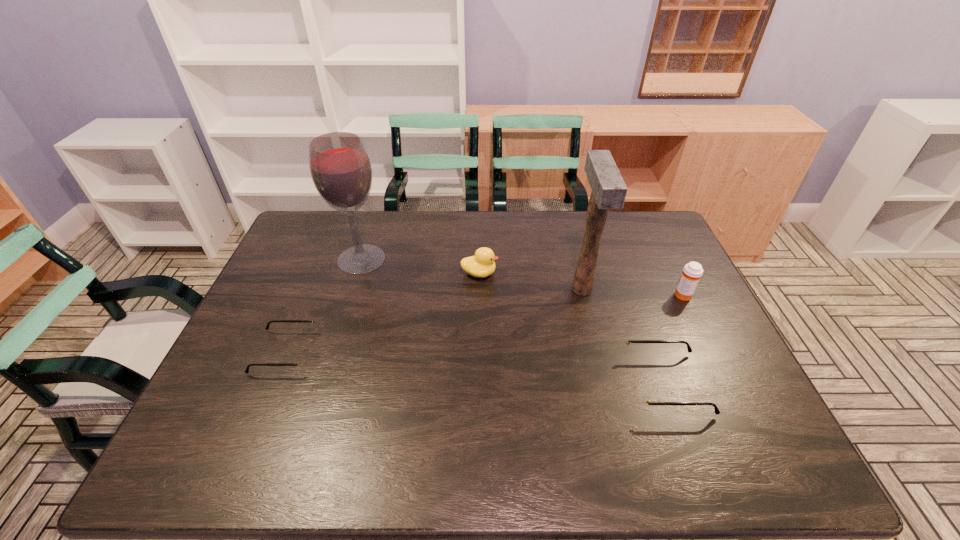
If equal spacing is desired by inserting an extra spectacles among them, please point out a free spot for this new spectacles. Please provide its 2D coordinates. Your answer should be formatted as a tuple, i.e. [(x, y)], where the tuple contains the x and y coordinates of a point satisfying the conditions above.

[(469, 368)]